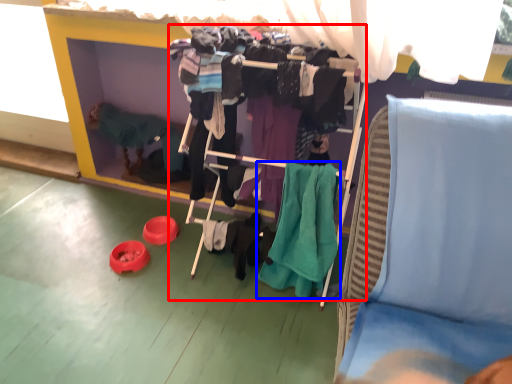
Question: Which object is closer to the camera taking this photo, closet (highlighted by a red box) or clothing (highlighted by a blue box)?

Choices:
 (A) closet
 (B) clothing

Answer: (A)